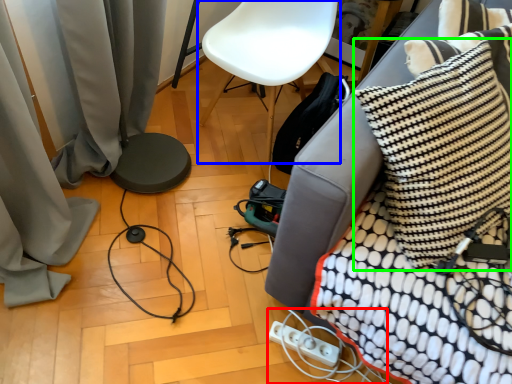
Question: Considering the real-world distances, which object is closest to extension cord (highlighted by a red box)? armchair (highlighted by a blue box) or pillow (highlighted by a green box).

Choices:
 (A) armchair
 (B) pillow

Answer: (B)